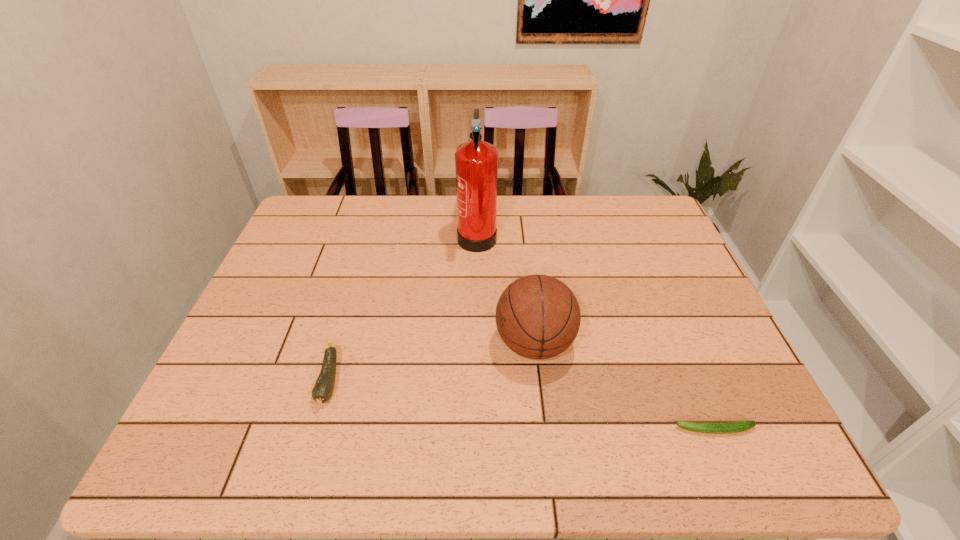
The width and height of the screenshot is (960, 540). In the image, there is a desktop. Identify the location of free space at the near edge. (579, 429).

Locate an element on the screen. The width and height of the screenshot is (960, 540). vacant space at the left edge of the desktop is located at coordinates (259, 349).

At what (x,y) coordinates should I click in order to perform the action: click on free space at the right edge of the desktop. Please return your answer as a coordinate pair (x, y). Image resolution: width=960 pixels, height=540 pixels. Looking at the image, I should click on (653, 264).

In the image, there is a desktop. Where is `vacant space at the far left corner`? vacant space at the far left corner is located at coordinates (313, 206).

Locate an element on the screen. Image resolution: width=960 pixels, height=540 pixels. free space between the shortest object and the farthest object is located at coordinates (596, 332).

The width and height of the screenshot is (960, 540). I want to click on free space between the fire extinguisher and the third tallest object, so click(403, 307).

You are a GUI agent. You are given a task and a screenshot of the screen. Output one action in this format:
    pyautogui.click(x=<x>, y=<y>)
    Task: Click on the free spot between the third tallest object and the fire extinguisher
    This screenshot has height=540, width=960.
    Given the screenshot: What is the action you would take?
    pyautogui.click(x=403, y=307)

The image size is (960, 540). In order to click on vacant region between the third shortest object and the nearest object in this screenshot , I will do `click(625, 387)`.

Locate an element on the screen. free point between the nearer zucchini and the fire extinguisher is located at coordinates (596, 332).

Find the location of a particular element. The width and height of the screenshot is (960, 540). unoccupied position between the right zucchini and the third shortest object is located at coordinates (625, 387).